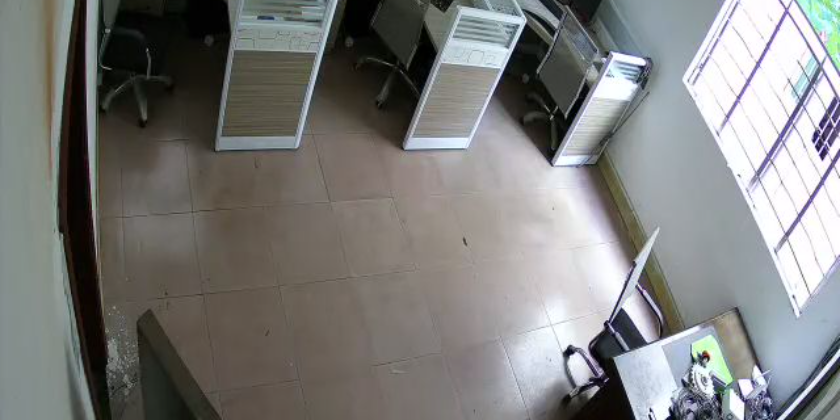
Identify the location of desk. Image resolution: width=840 pixels, height=420 pixels. (623, 361), (604, 102), (400, 54), (249, 27).